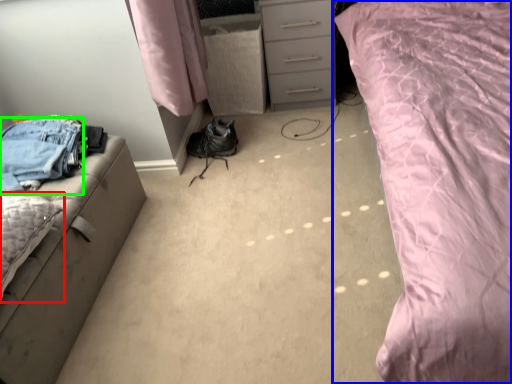
Question: Which object is the farthest from pillow (highlighted by a red box)? Choose among these: bed (highlighted by a blue box) or trousers (highlighted by a green box).

Choices:
 (A) bed
 (B) trousers

Answer: (A)